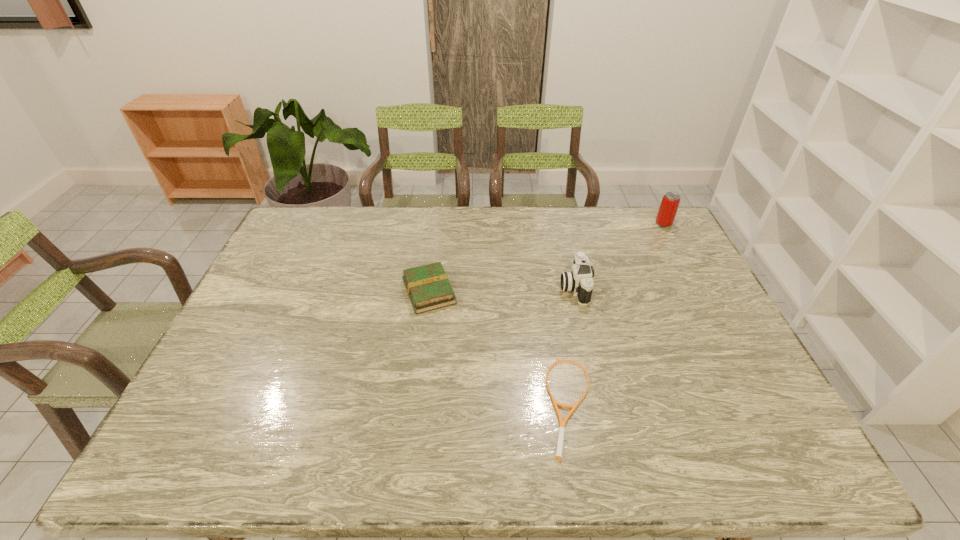
Identify the location of vacant space situated 0.240m on the left of the nearest object. The height and width of the screenshot is (540, 960). (448, 406).

Where is `object situated at the far edge`? object situated at the far edge is located at coordinates (669, 205).

This screenshot has height=540, width=960. Identify the location of object present at the near edge. (558, 455).

Where is `object that is positioned at the right edge`? This screenshot has width=960, height=540. object that is positioned at the right edge is located at coordinates (669, 205).

Identify the location of object at the far right corner. This screenshot has height=540, width=960. coord(669,205).

Image resolution: width=960 pixels, height=540 pixels. In the image, there is a desktop. Find the location of `vacant space at the far edge`. vacant space at the far edge is located at coordinates (345, 215).

Where is `vacant space at the near edge`? vacant space at the near edge is located at coordinates (685, 464).

In order to click on blank space at the left edge of the desktop in this screenshot , I will do coord(232,388).

Locate an element on the screen. Image resolution: width=960 pixels, height=540 pixels. vacant space at the right edge of the desktop is located at coordinates (659, 260).

You are a GUI agent. You are given a task and a screenshot of the screen. Output one action in this format:
    pyautogui.click(x=<x>, y=<y>)
    Task: Click on the free space that is in between the third tallest object and the camera
    Image resolution: width=960 pixels, height=540 pixels.
    Given the screenshot: What is the action you would take?
    pyautogui.click(x=502, y=289)